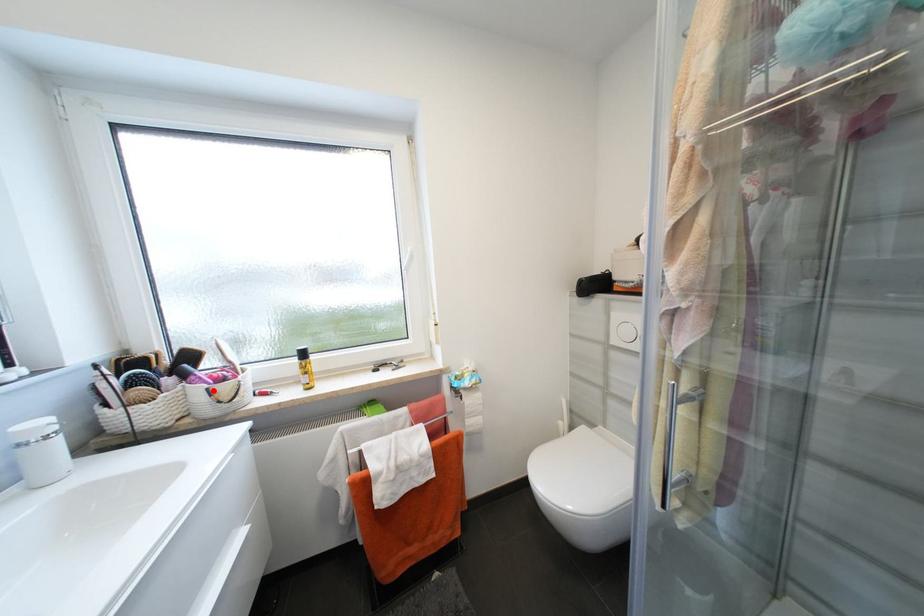
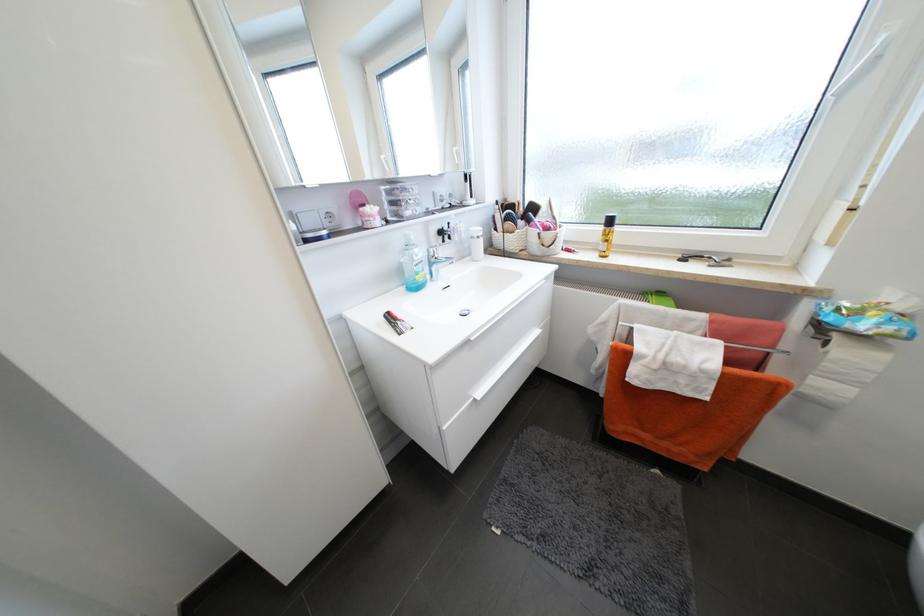
Question: I am providing you with two images of the same scene from different viewpoints. A red point is shown in image1. For the corresponding object point in image2, is it positioned nearer or farther from the camera?

Choices:
 (A) Nearer
 (B) Farther

Answer: (A)